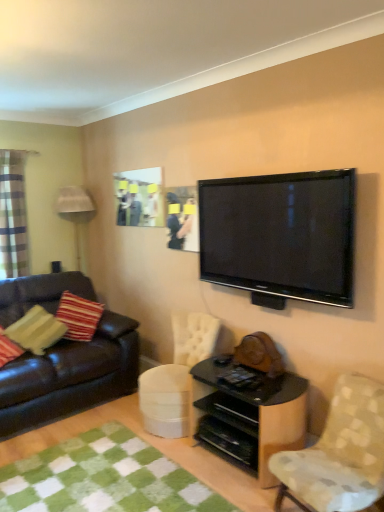
This screenshot has width=384, height=512. What do you see at coordinates (234, 408) in the screenshot?
I see `black plastic drawer at lower center` at bounding box center [234, 408].

I want to click on leather couch at left, so click(70, 376).

Measure the distance between matte plastic picture frame at upper center and camera.

The distance of matte plastic picture frame at upper center from camera is 11.86 feet.

Where is `plaid fabric curtain at left`? The width and height of the screenshot is (384, 512). plaid fabric curtain at left is located at coordinates tap(13, 215).

Are white fabric swivel chair at center and black glossy tv at upper right making contact?

No, white fabric swivel chair at center is not beside black glossy tv at upper right.

Considering the relative sizes of white fabric swivel chair at center and black glossy tv at upper right in the image provided, is white fabric swivel chair at center taller than black glossy tv at upper right?

No.

Which is behind, white fabric swivel chair at center or black glossy tv at upper right?

white fabric swivel chair at center is more distant.

How different are the orientations of white fabric swivel chair at center and black glossy tv at upper right in degrees?

The angle between the facing direction of white fabric swivel chair at center and the facing direction of black glossy tv at upper right is 1.19 degrees.

From a real-world perspective, which object rests below the other?

From a 3D spatial view, green checkered rug at lower left is below.

Could you tell me if patterned fabric chair at lower right is turned towards green checkered rug at lower left?

No, patterned fabric chair at lower right is not oriented towards green checkered rug at lower left.

Between patterned fabric chair at lower right and green checkered rug at lower left, which one has larger size?

patterned fabric chair at lower right.

Find the location of `chair on the right of the green checkered rug at lower left`. chair on the right of the green checkered rug at lower left is located at coordinates (339, 453).

Considering the positions of objects patterned fabric chair at lower right and black glossy tv at upper right in the image provided, who is more to the left, patterned fabric chair at lower right or black glossy tv at upper right?

black glossy tv at upper right.

In the scene shown: From the image's perspective, is patterned fabric chair at lower right positioned above or below black glossy tv at upper right?

Based on their image positions, patterned fabric chair at lower right is located beneath black glossy tv at upper right.

Is point (296, 490) positioned after point (225, 221)?

That is False.

Is patterned fabric chair at lower right turned away from black glossy tv at upper right?

No, patterned fabric chair at lower right is not facing away from black glossy tv at upper right.

From the image's perspective, which one is positioned lower, matte plastic picture frame at upper center or striped fabric pillow at left?

striped fabric pillow at left.

What are the coordinates of `picture frame behind the striped fabric pillow at left` in the screenshot? It's located at (139, 197).

Does matte plastic picture frame at upper center turn towards striped fabric pillow at left?

No, matte plastic picture frame at upper center is not turned towards striped fabric pillow at left.

Considering the relative sizes of matte plastic picture frame at upper center and striped fabric pillow at left in the image provided, is matte plastic picture frame at upper center bigger than striped fabric pillow at left?

Incorrect, matte plastic picture frame at upper center is not larger than striped fabric pillow at left.

Is leather couch at left smaller than striped fabric pillow at left?

Actually, leather couch at left might be larger than striped fabric pillow at left.

Is leather couch at left facing away from striped fabric pillow at left?

Yes, striped fabric pillow at left is at the back of leather couch at left.

Is leather couch at left situated inside striped fabric pillow at left or outside?

leather couch at left lies outside striped fabric pillow at left.

From a real-world perspective, is green checkered rug at lower left positioned over striped fabric pillow at left based on gravity?

Incorrect, from a real-world perspective, green checkered rug at lower left is lower than striped fabric pillow at left.

Is striped fabric pillow at left at the back of green checkered rug at lower left?

No, green checkered rug at lower left's orientation is not away from striped fabric pillow at left.

Would you say green checkered rug at lower left is outside striped fabric pillow at left?

That's correct, green checkered rug at lower left is outside of striped fabric pillow at left.

Looking at this image, relative to striped fabric pillow at left, is green checkered rug at lower left in front or behind?

In the image, green checkered rug at lower left appears in front of striped fabric pillow at left.

Is black glossy shelf at lower center to the left or to the right of striped fabric pillow at left in the image?

Based on their positions, black glossy shelf at lower center is located to the right of striped fabric pillow at left.

Consider the image. What's the angular difference between black glossy shelf at lower center and striped fabric pillow at left's facing directions?

The angle between the facing direction of black glossy shelf at lower center and the facing direction of striped fabric pillow at left is 123 degrees.

From the picture: Would you say black glossy shelf at lower center is a long distance from striped fabric pillow at left?

Yes, black glossy shelf at lower center is far from striped fabric pillow at left.

Does point (207, 391) come closer to viewer compared to point (61, 328)?

Yes, point (207, 391) is closer to viewer.

Identify the location of television on the right of white fabric swivel chair at center. (280, 236).

There is a green checkered rug at lower left. What are the coordinates of `chair above it (from a real-world perspective)` in the screenshot? It's located at (339, 453).

Estimate the real-world distances between objects in this image. Which object is closer to black glossy shelf at lower center, white fabric swivel chair at center or green checkered rug at lower left?

white fabric swivel chair at center lies closer to black glossy shelf at lower center than the other object.

When comparing their distances from black plastic drawer at lower center, does white fabric swivel chair at center or black glossy tv at upper right seem closer?

The object closer to black plastic drawer at lower center is white fabric swivel chair at center.

Which object lies further to the anchor point green checkered rug at lower left, black plastic drawer at lower center or white fabric swivel chair at center?

black plastic drawer at lower center lies further to green checkered rug at lower left than the other object.

From the picture: Which object lies nearer to the anchor point green checkered rug at lower left, striped fabric pillow at left or black glossy shelf at lower center?

Among the two, black glossy shelf at lower center is located nearer to green checkered rug at lower left.

Which object lies further to the anchor point striped fabric pillow at left, green checkered rug at lower left or black glossy tv at upper right?

black glossy tv at upper right lies further to striped fabric pillow at left than the other object.

From the picture: Considering their positions, is black plastic drawer at lower center positioned further to leather couch at left than patterned fabric chair at lower right?

patterned fabric chair at lower right is further to leather couch at left.

Which object lies nearer to the anchor point striped fabric pillow at left, plaid fabric curtain at left or black plastic drawer at lower center?

plaid fabric curtain at left.

Looking at the image, which one is located closer to black glossy shelf at lower center, white fabric swivel chair at center or plaid fabric curtain at left?

white fabric swivel chair at center is positioned closer to the anchor black glossy shelf at lower center.

Where is `picture frame situated between leather couch at left and patterned fabric chair at lower right from left to right`? This screenshot has width=384, height=512. picture frame situated between leather couch at left and patterned fabric chair at lower right from left to right is located at coordinates (139, 197).

The image size is (384, 512). What are the coordinates of `picture frame between striped fabric pillow at left and black glossy tv at upper right in the horizontal direction` in the screenshot? It's located at (139, 197).

The height and width of the screenshot is (512, 384). I want to click on pillow between green checkered rug at lower left and plaid fabric curtain at left in the front-back direction, so click(x=36, y=330).

Locate an element on the screen. The image size is (384, 512). shelf between plaid fabric curtain at left and black glossy tv at upper right in the horizontal direction is located at coordinates pyautogui.click(x=249, y=418).